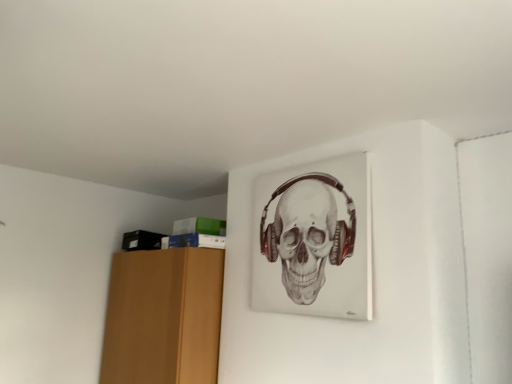
Find the location of `vacant area on top of gray matte skull at upper center (from a real-world perspective)`. vacant area on top of gray matte skull at upper center (from a real-world perspective) is located at coordinates (313, 164).